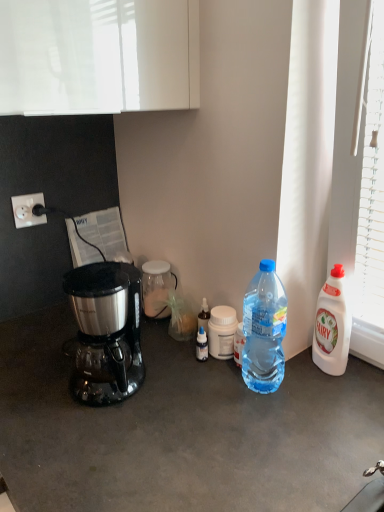
Question: Which direction should I rotate to look at white plastic bottle at center, the 2th bottle when ordered from right to left, — up or down?

Choices:
 (A) down
 (B) up

Answer: (A)

Question: Is the position of white plastic power outlet at left less distant than that of white plastic bottle at center, the second bottle when ordered from back to front?

Choices:
 (A) yes
 (B) no

Answer: (B)

Question: Is white plastic bottle at center, the second bottle when ordered from back to front, at the back of white plastic power outlet at left?

Choices:
 (A) yes
 (B) no

Answer: (B)

Question: Is white plastic power outlet at left further to the viewer compared to white plastic bottle at center, the 2th bottle when ordered from right to left?

Choices:
 (A) yes
 (B) no

Answer: (A)

Question: Is white plastic power outlet at left thinner than white plastic bottle at center, positioned as the 2th bottle in front-to-back order?

Choices:
 (A) yes
 (B) no

Answer: (A)

Question: From a real-world perspective, is white plastic power outlet at left physically above white plastic bottle at center, the 2th bottle when ordered from right to left?

Choices:
 (A) yes
 (B) no

Answer: (A)

Question: Is white plastic power outlet at left to the left of white plastic bottle at center, acting as the second bottle starting from the left, from the viewer's perspective?

Choices:
 (A) yes
 (B) no

Answer: (A)

Question: Does white plastic bottle at right, the third bottle viewed from the left, touch white plastic power outlet at left?

Choices:
 (A) yes
 (B) no

Answer: (B)

Question: From the image's perspective, does white plastic bottle at right, the third bottle viewed from the left, appear lower than white plastic power outlet at left?

Choices:
 (A) yes
 (B) no

Answer: (A)

Question: Is white plastic bottle at right, the 3th bottle viewed from the back, oriented away from white plastic power outlet at left?

Choices:
 (A) yes
 (B) no

Answer: (B)

Question: Are white plastic bottle at right, the third bottle viewed from the left, and white plastic power outlet at left far apart?

Choices:
 (A) no
 (B) yes

Answer: (A)

Question: Is white plastic bottle at right, the third bottle viewed from the left, positioned before white plastic power outlet at left?

Choices:
 (A) yes
 (B) no

Answer: (A)

Question: Is white plastic bottle at right, the third bottle viewed from the left, located outside white plastic power outlet at left?

Choices:
 (A) yes
 (B) no

Answer: (A)

Question: Can you confirm if stainless steel coffee maker at left is positioned to the right of white plastic bottle at right, the 3th bottle viewed from the back?

Choices:
 (A) no
 (B) yes

Answer: (A)